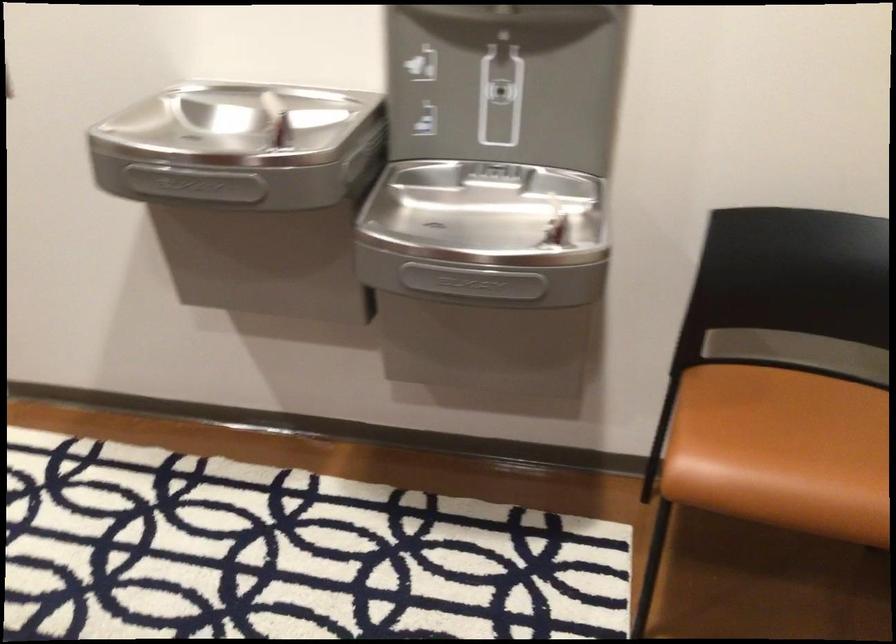
Find the location of a particular element. water bottle sensor is located at coordinates (501, 93).